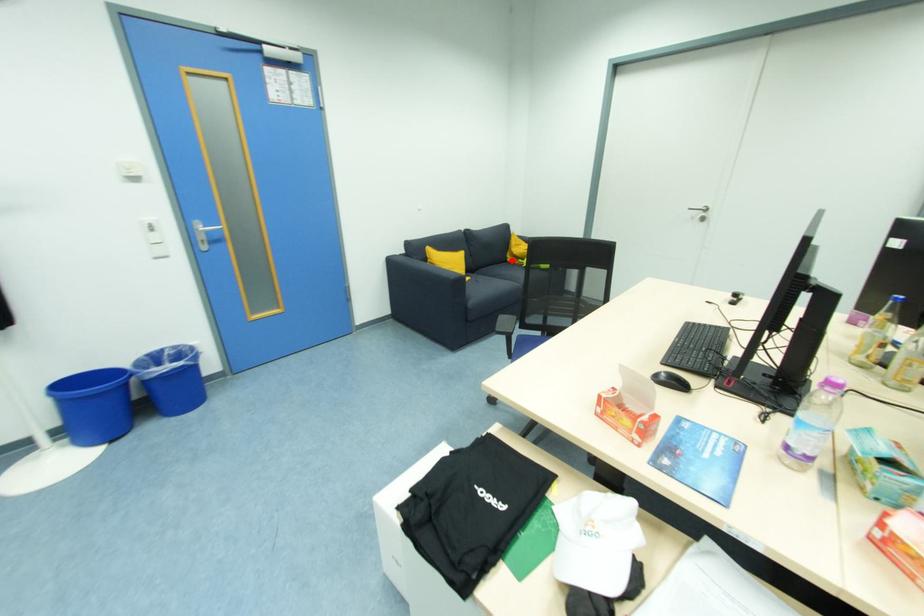
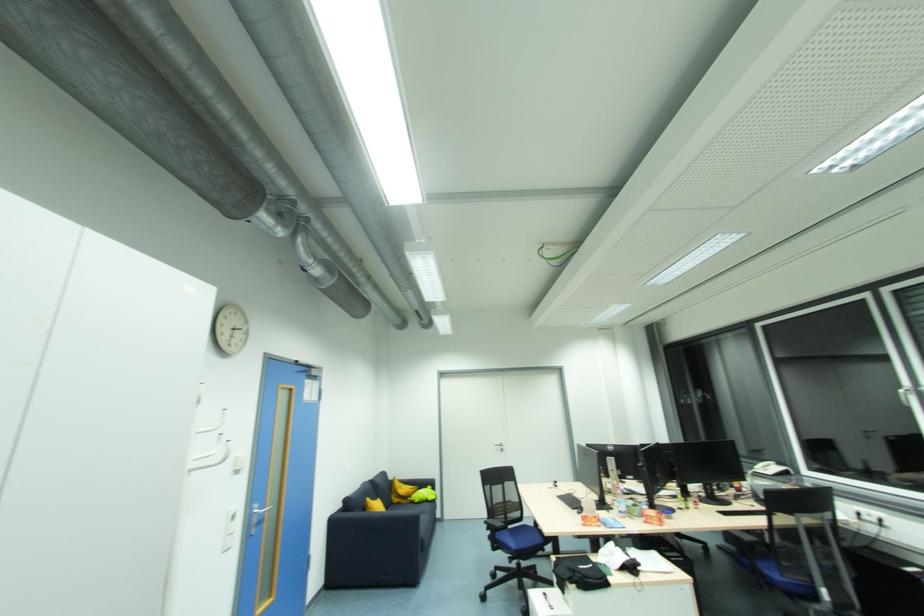
Find the pixel in the second image that matches the highlighted location in the first image.

(397, 501)